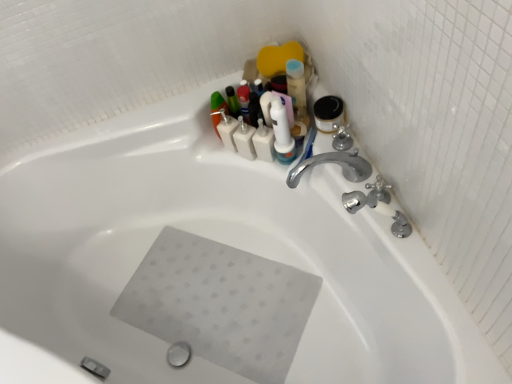
The height and width of the screenshot is (384, 512). Find the location of `free point in front of silver metallic faucet at upper right, which ranks as the first plumbing fixture in front-to-back order`. free point in front of silver metallic faucet at upper right, which ranks as the first plumbing fixture in front-to-back order is located at coordinates (428, 283).